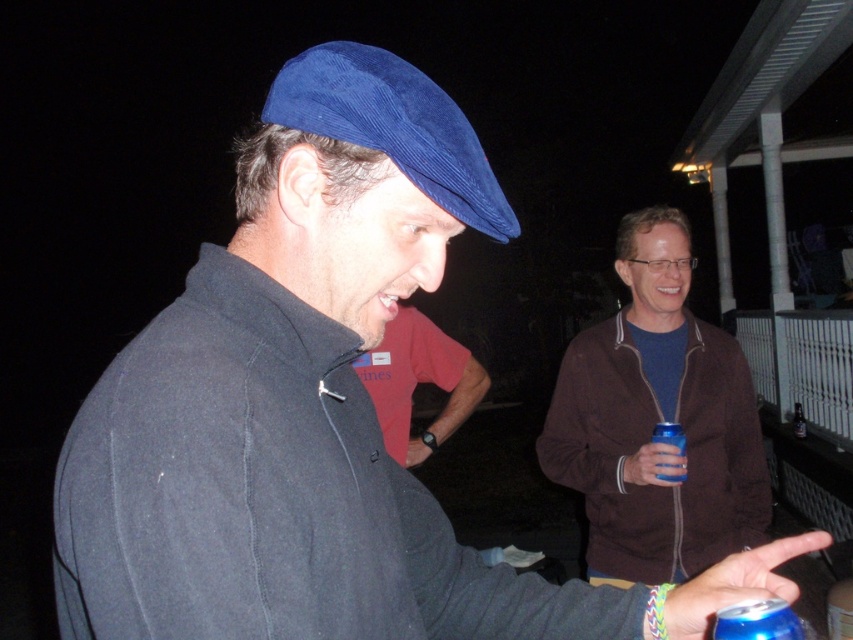
Does red cotton t-shirt at center have a smaller size compared to translucent plastic bottle at right?

Incorrect, red cotton t-shirt at center is not smaller in size than translucent plastic bottle at right.

Who is taller, red cotton t-shirt at center or translucent plastic bottle at right?

red cotton t-shirt at center

Is point (474, 358) closer to camera compared to point (795, 417)?

Yes, it is in front of point (795, 417).

This screenshot has width=853, height=640. In order to click on red cotton t-shirt at center in this screenshot , I will do `click(418, 381)`.

Who is lower down, brown fleece jacket at upper right or velvet blue cap at center?

brown fleece jacket at upper right is below.

Is brown fleece jacket at upper right above velvet blue cap at center?

Actually, brown fleece jacket at upper right is below velvet blue cap at center.

Where is `brown fleece jacket at upper right`? brown fleece jacket at upper right is located at coordinates (657, 420).

Where is `brown fleece jacket at upper right`? The height and width of the screenshot is (640, 853). brown fleece jacket at upper right is located at coordinates (657, 420).

Is brown fleece jacket at upper right taller than blue metallic can at lower right?

Correct, brown fleece jacket at upper right is much taller as blue metallic can at lower right.

Measure the distance between brown fleece jacket at upper right and blue metallic can at lower right.

A distance of 4.05 feet exists between brown fleece jacket at upper right and blue metallic can at lower right.

Measure the distance between brown fleece jacket at upper right and camera.

The distance of brown fleece jacket at upper right from camera is 5.91 feet.

Where is `brown fleece jacket at upper right`? brown fleece jacket at upper right is located at coordinates (657, 420).